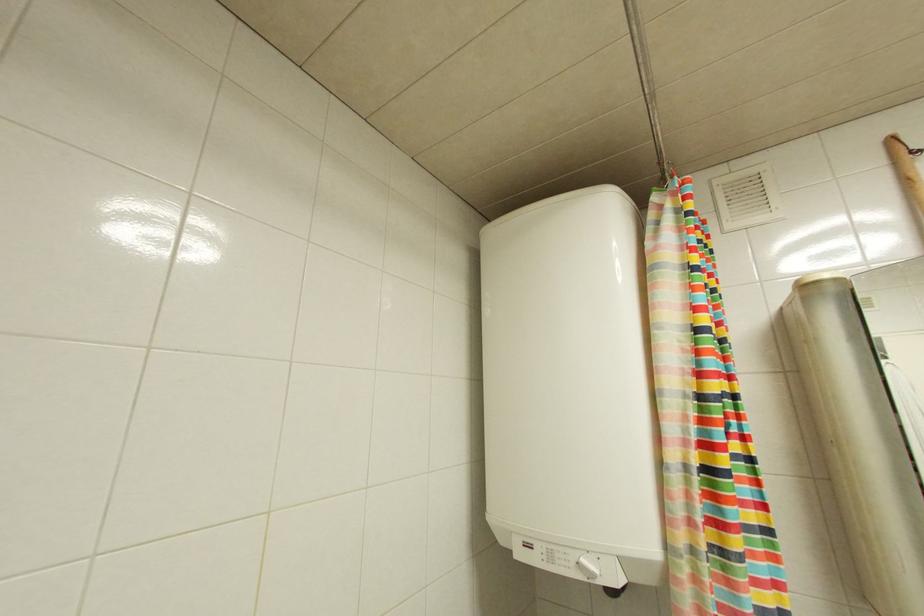
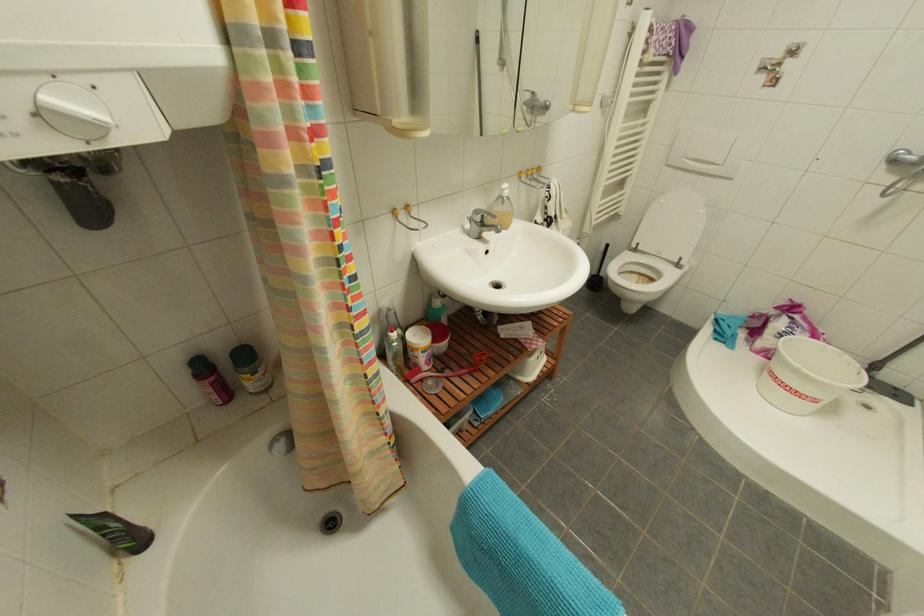
How did the camera likely rotate?

The camera rotated toward right-down.